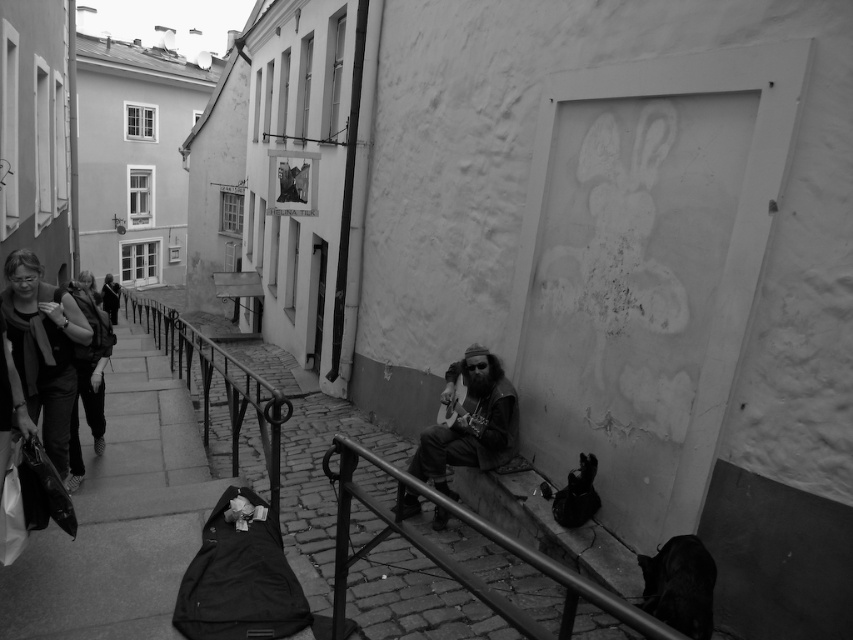
You are standing at the point marked by the coordinates point (456,561) in the image. Looking around, you see a metallic rail at lower center. What object is located at your current position?

The point (456,561) corresponds to the metallic rail at lower center.

You are a photographer standing in the street scene and want to capture both the matte black jacket at left and the matte black backpack at left in a single frame. Since they are both on the left side, which one should you adjust your camera angle to focus on to ensure both are in the frame?

The matte black jacket at left has a lesser height compared to the matte black backpack at left, so you should adjust your camera angle to focus on the lower area to include both the shorter jacket and the taller backpack in the frame.

You are a street performer who just arrived at this location. You need to place your dark brown leather guitar at center and your matte black backpack at left in such a way that they both fit on the narrow cobblestone street without overlapping. Given that the street is only 1.2 meters wide, can you position them side by side?

The dark brown leather guitar at center is shorter than the matte black backpack at left. However, since the street is only 1.2 meters wide and the combined width of both items exceeds this measurement, they cannot be placed side by side without overlapping.